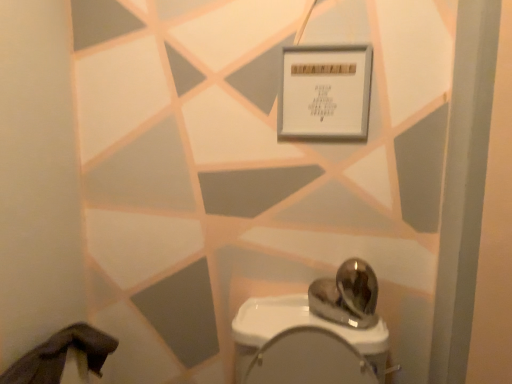
You are a GUI agent. You are given a task and a screenshot of the screen. Output one action in this format:
    pyautogui.click(x=<x>, y=<y>)
    Task: Click on the white matte picture frame at upper center
    Image resolution: width=512 pixels, height=384 pixels.
    Given the screenshot: What is the action you would take?
    pyautogui.click(x=325, y=92)

The height and width of the screenshot is (384, 512). What do you see at coordinates (325, 92) in the screenshot?
I see `white matte picture frame at upper center` at bounding box center [325, 92].

You are a GUI agent. You are given a task and a screenshot of the screen. Output one action in this format:
    pyautogui.click(x=<x>, y=<y>)
    Task: Click on the white matte picture frame at upper center
    
    Given the screenshot: What is the action you would take?
    pyautogui.click(x=325, y=92)